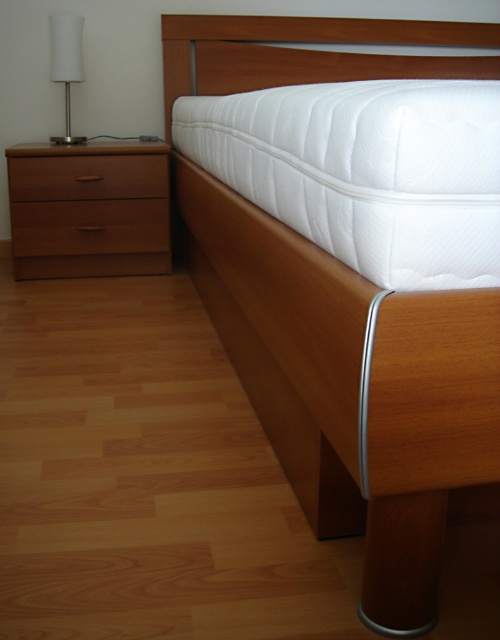
In the scene shown: You are standing in the bedroom and want to determine which of the two points, point [458,28] or point [128,177], is closer to you. Based on the scene, which point is nearer?

Point [458,28] is further to the camera than point [128,177], so point [128,177] is closer to you.